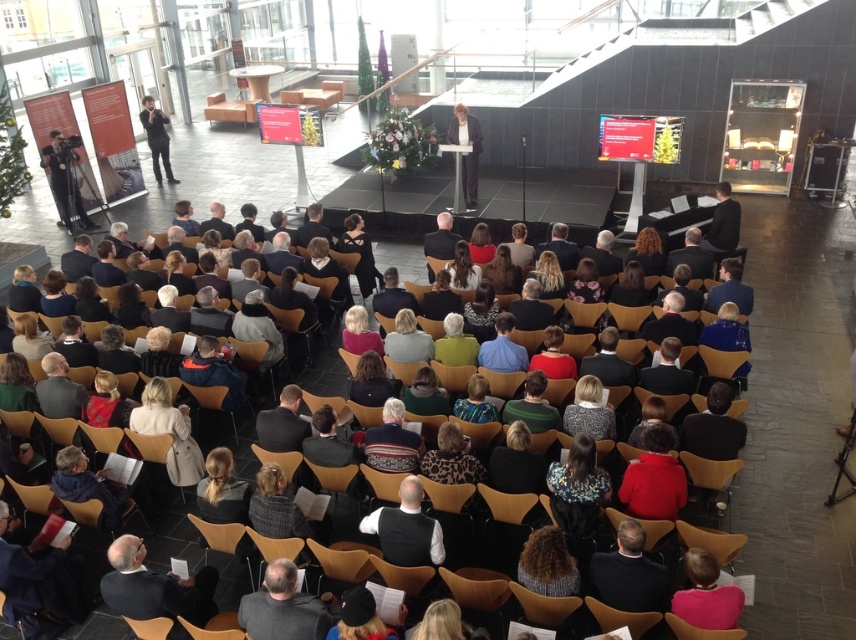
Question: Does light gray sweater at center appear over red matte sweater at center?

Choices:
 (A) no
 (B) yes

Answer: (B)

Question: Is dark gray suit at lower center wider than black vest at center?

Choices:
 (A) yes
 (B) no

Answer: (B)

Question: Which point is closer to the camera?

Choices:
 (A) (405, 344)
 (B) (152, 154)

Answer: (A)

Question: Is light gray sweater at center to the left of red matte sweater at center from the viewer's perspective?

Choices:
 (A) no
 (B) yes

Answer: (B)

Question: Which point is farther from the camera taking this photo?

Choices:
 (A) (603, 556)
 (B) (728, 595)
 (C) (605, 408)

Answer: (C)

Question: Estimate the real-world distances between objects in this image. Which object is farther from the black vest at center?

Choices:
 (A) matte black camera at left
 (B) dark brown leather jacket at center
 (C) light gray sweater at center

Answer: (A)